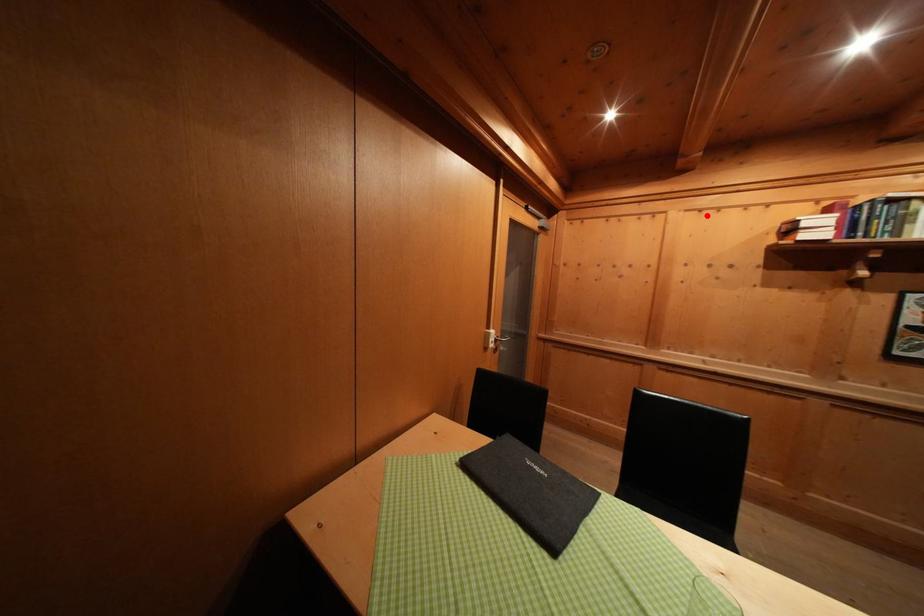
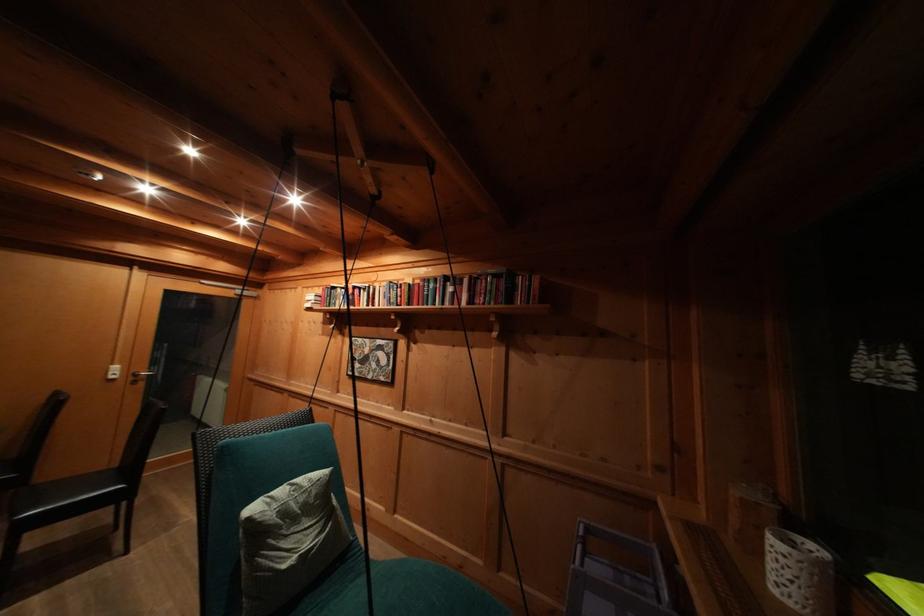
Where in the second image is the point corresponding to the highlighted location from the first image?

(313, 293)